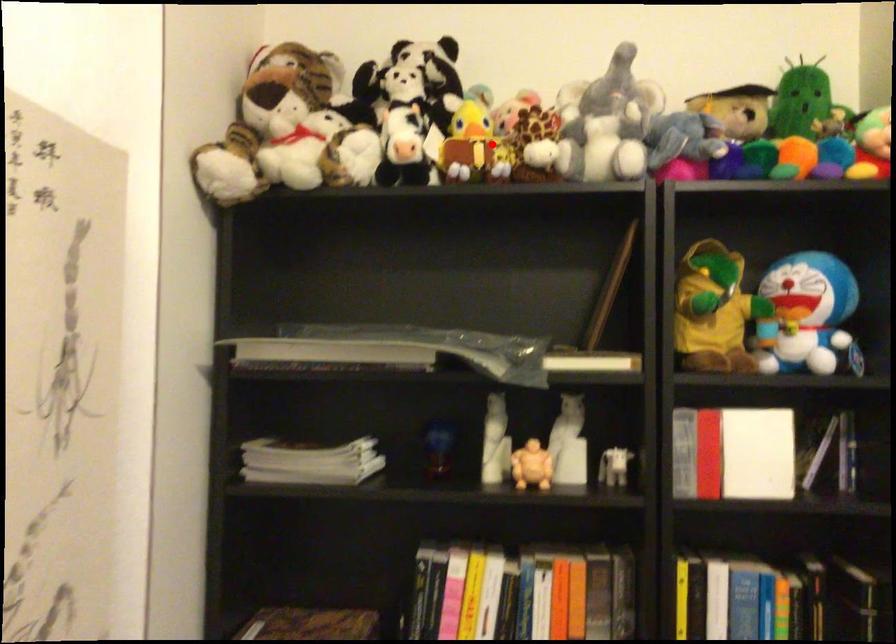
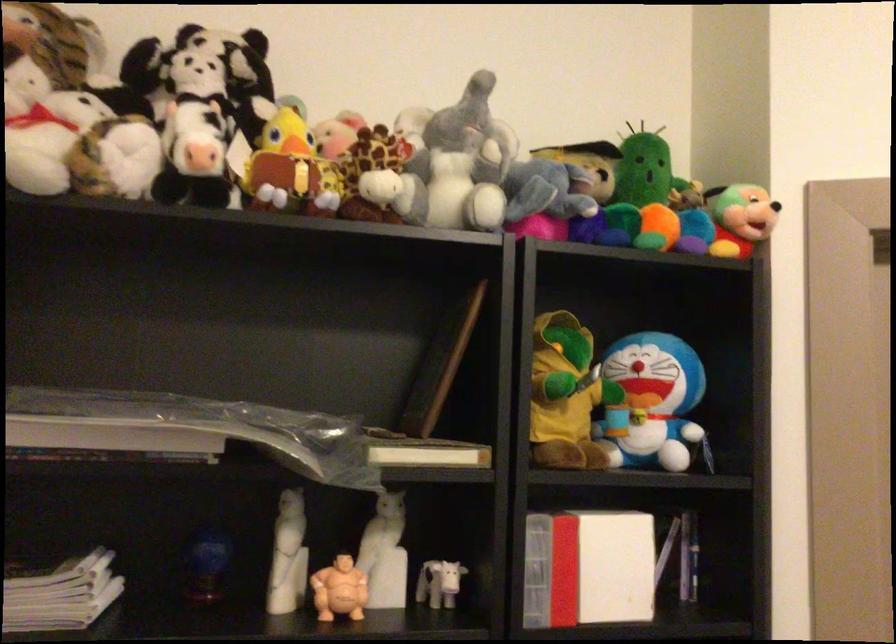
Question: I am providing you with two images of the same scene from different viewpoints. In image1, a red point is highlighted. Considering the same 3D point in image2, which of the following is correct?

Choices:
 (A) It is closer
 (B) It is farther

Answer: (A)